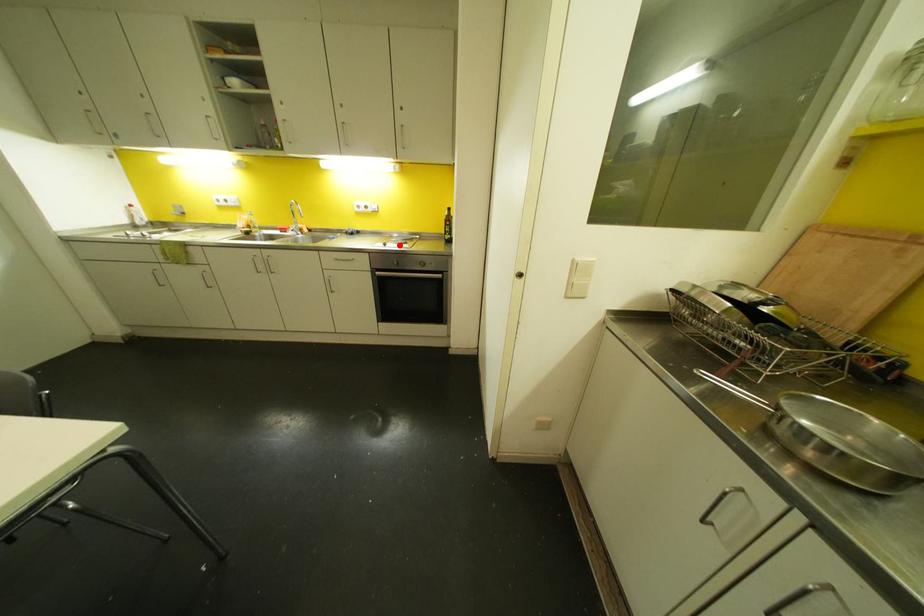
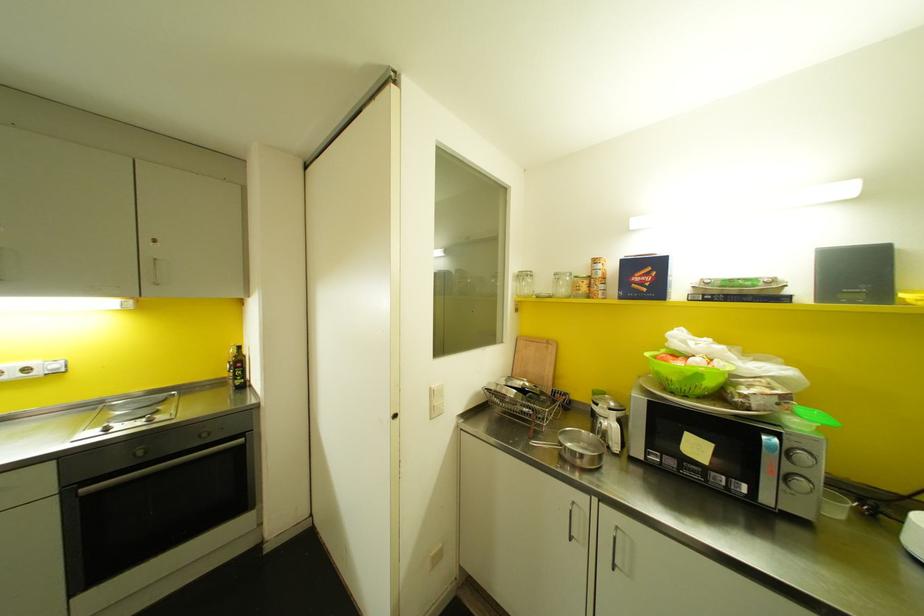
Where in the second image is the point corresponding to the highlighted location from the first image?

(150, 419)